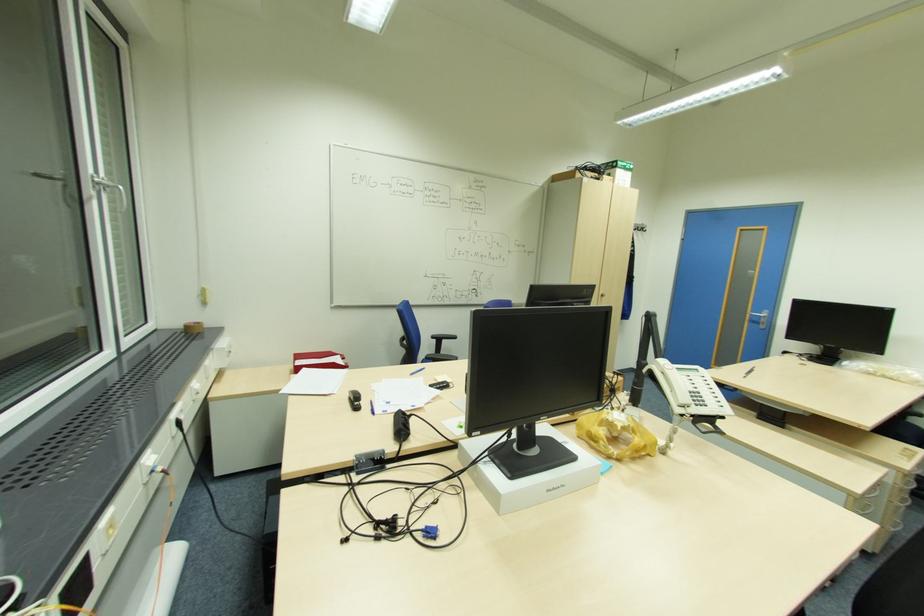
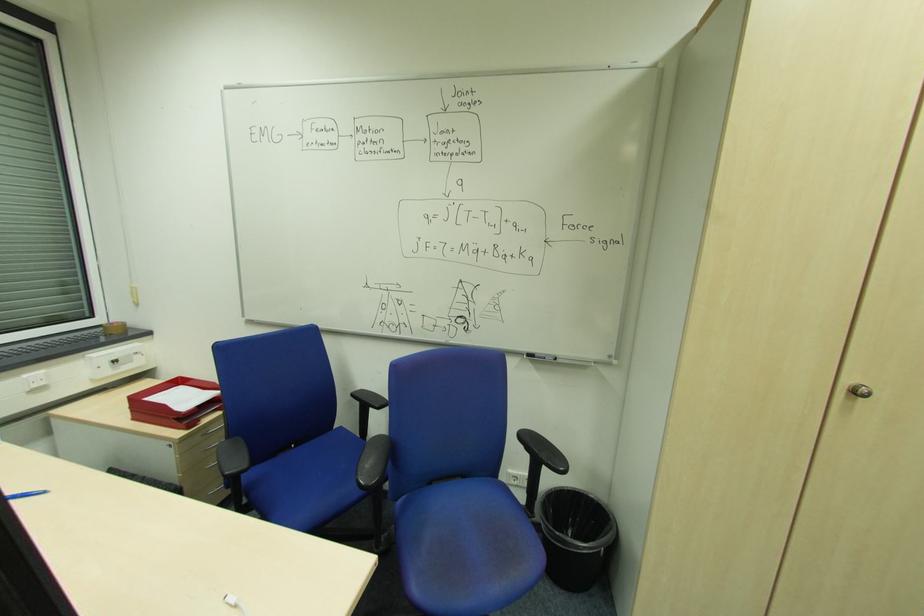
Where in the second image is the point corresponding to [604,294] from the first image?

(860, 392)